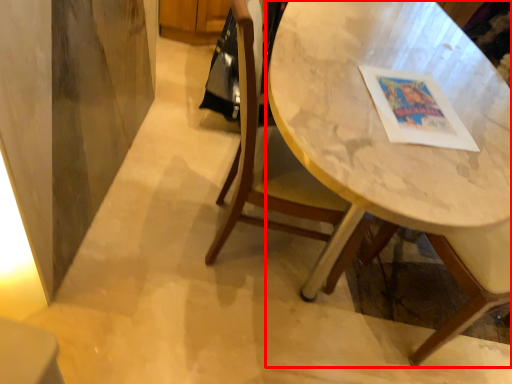
Question: From the image's perspective, considering the relative positions of table (annotated by the red box) and chair in the image provided, where is table (annotated by the red box) located with respect to the staircase?

Choices:
 (A) above
 (B) below

Answer: (A)